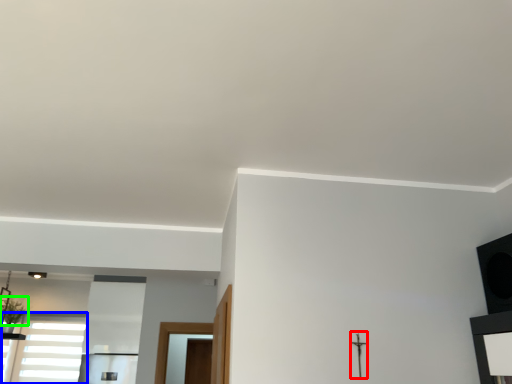
Question: Estimate the real-world distances between objects in this image. Which object is closer to crucifix (highlighted by a red box), window (highlighted by a blue box) or plant (highlighted by a green box)?

Choices:
 (A) window
 (B) plant

Answer: (A)